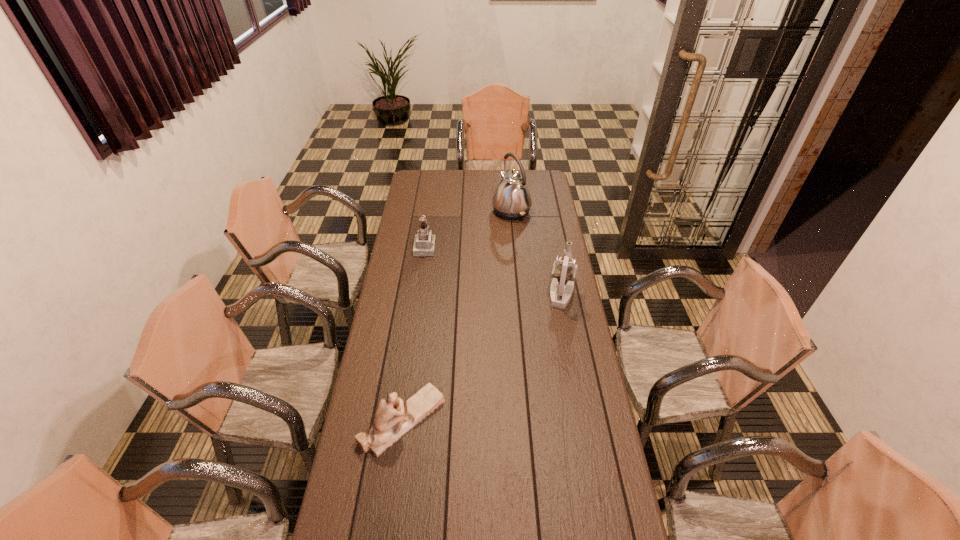
The height and width of the screenshot is (540, 960). I want to click on the farthest object, so click(512, 200).

I want to click on kettle, so click(512, 200).

The width and height of the screenshot is (960, 540). Identify the location of the second tallest object. (564, 270).

Locate an element on the screen. microscope is located at coordinates (564, 270).

Where is `the third nearest object`? This screenshot has height=540, width=960. the third nearest object is located at coordinates (424, 243).

Locate an element on the screen. The height and width of the screenshot is (540, 960). the shorter figurine is located at coordinates (393, 418).

The image size is (960, 540). What are the coordinates of `the nearest object` in the screenshot? It's located at (393, 418).

This screenshot has height=540, width=960. I want to click on vacant space located 0.260m on the left of the second object from right to left, so click(447, 211).

The image size is (960, 540). Find the location of `vacant space located 0.190m on the front of the third shortest object`. vacant space located 0.190m on the front of the third shortest object is located at coordinates (570, 342).

Where is `vacant space located 0.200m on the front-facing side of the third nearest object`? The height and width of the screenshot is (540, 960). vacant space located 0.200m on the front-facing side of the third nearest object is located at coordinates (473, 247).